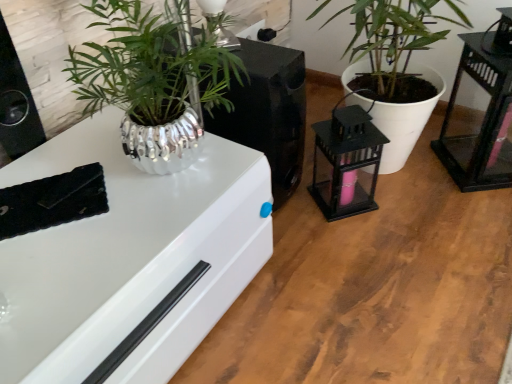
The width and height of the screenshot is (512, 384). Find the location of `vacant region in front of black metal lantern at center-right, acting as the 2th appliance starting from the left`. vacant region in front of black metal lantern at center-right, acting as the 2th appliance starting from the left is located at coordinates (353, 246).